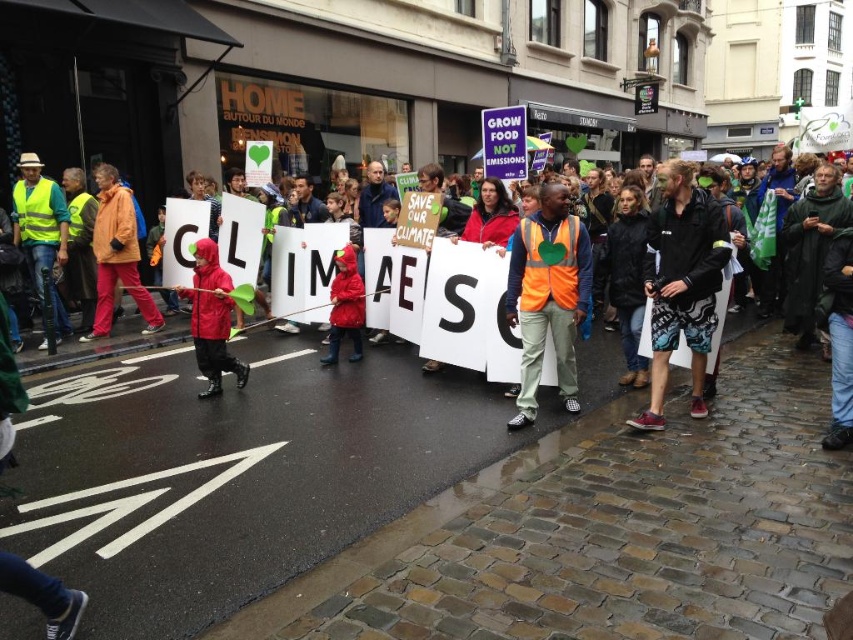
Question: Among these objects, which one is nearest to the camera?

Choices:
 (A) orange fabric jacket at left
 (B) rubberized red raincoat at center
 (C) orange reflective vest at center
 (D) black synthetic jacket at center

Answer: (D)

Question: Which object is closer to the camera taking this photo?

Choices:
 (A) rubberized red raincoat at center
 (B) black synthetic jacket at center
 (C) orange fabric jacket at left
 (D) orange reflective vest at center

Answer: (B)

Question: Does black synthetic jacket at center lie behind orange fabric jacket at left?

Choices:
 (A) no
 (B) yes

Answer: (A)

Question: Does black synthetic jacket at center lie in front of orange reflective vest at center?

Choices:
 (A) no
 (B) yes

Answer: (B)

Question: Is orange reflective vest at center wider than orange fabric jacket at left?

Choices:
 (A) yes
 (B) no

Answer: (B)

Question: Which object appears farthest from the camera in this image?

Choices:
 (A) rubberized red raincoat at center
 (B) orange fabric jacket at left

Answer: (B)